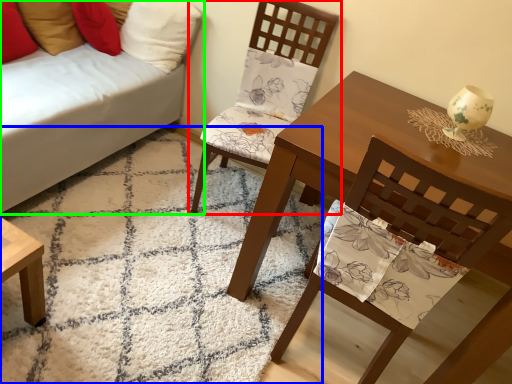
Question: Based on their relative distances, which object is nearer to chair (highlighted by a red box)? Choose from mat (highlighted by a blue box) and studio couch (highlighted by a green box).

Choices:
 (A) mat
 (B) studio couch

Answer: (B)